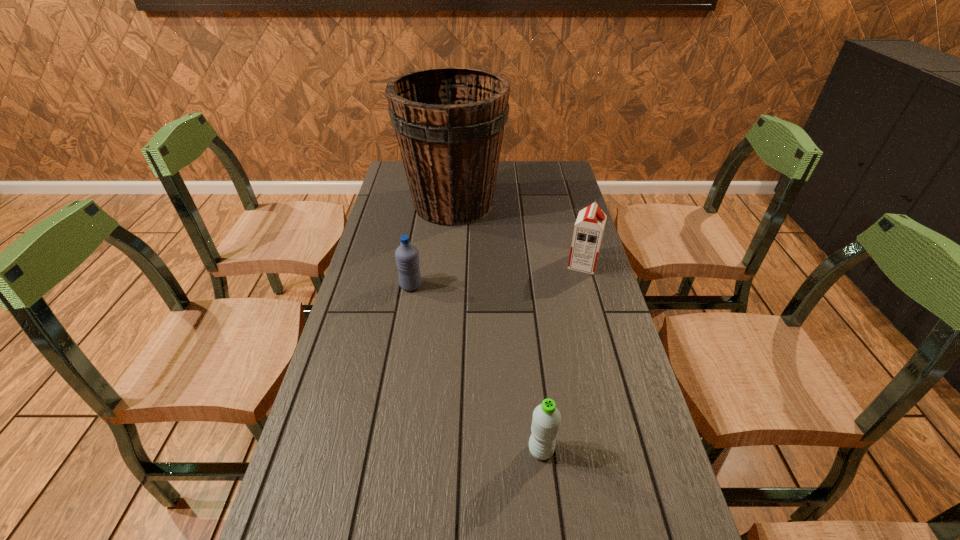
Identify the location of vacant position located 0.210m on the back of the second nearest object. 420,238.

Identify the location of blank space located on the front of the right water bottle. (545, 488).

Find the location of a particular element. object situated at the far edge is located at coordinates (449, 122).

Find the location of `bucket that is at the left edge`. bucket that is at the left edge is located at coordinates (449, 122).

Where is `water bottle that is at the left edge`? This screenshot has height=540, width=960. water bottle that is at the left edge is located at coordinates (407, 256).

At what (x,y) coordinates should I click in order to perform the action: click on object located in the right edge section of the desktop. Please return your answer as a coordinate pair (x, y). The height and width of the screenshot is (540, 960). Looking at the image, I should click on (588, 230).

Find the location of a particular element. object that is at the far left corner is located at coordinates (449, 122).

Where is `free space at the left edge of the desktop`? Image resolution: width=960 pixels, height=540 pixels. free space at the left edge of the desktop is located at coordinates (359, 461).

Identify the location of vacant space at the right edge of the desktop. The width and height of the screenshot is (960, 540). click(608, 360).

In the image, there is a desktop. At what (x,y) coordinates should I click in order to perform the action: click on free space at the far left corner. Please return your answer as a coordinate pair (x, y). Looking at the image, I should click on (397, 164).